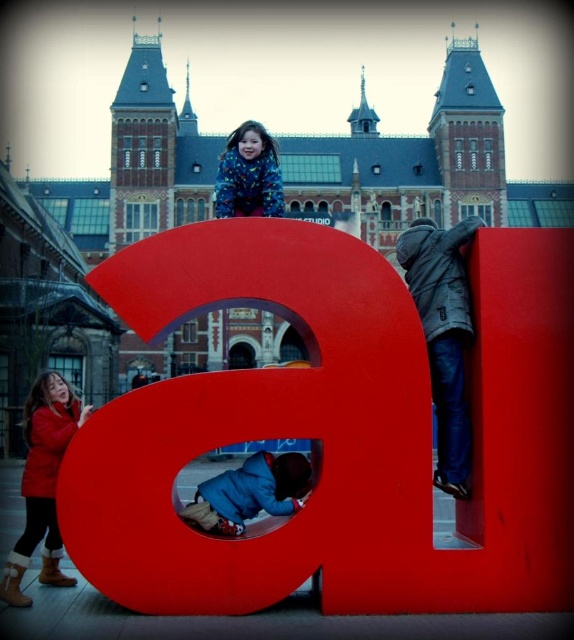
You are standing at the point closest to the historic building. Which of the two points, point (470, 218) or point (250, 196), is farther away from you?

Point (470, 218) is farther away from you because it is behind point (250, 196).

You are a photographer trying to capture both the blue fleece jacket at lower center and the fluffy blue jacket at center in a single shot. Based on their positions, which jacket should you focus on first to ensure both are in frame?

The blue fleece jacket at lower center is to the right of the fluffy blue jacket at center, so you should focus on the fluffy blue jacket at center first to ensure both are in frame.

You are a photographer trying to capture both the dark gray jacket at right and the red leather coat at lower left in the same frame. Based on their positions, which direction should you move your camera to include both subjects?

Since the dark gray jacket at right is to the right of the red leather coat at lower left, you should move your camera to the left to include both subjects in the frame.